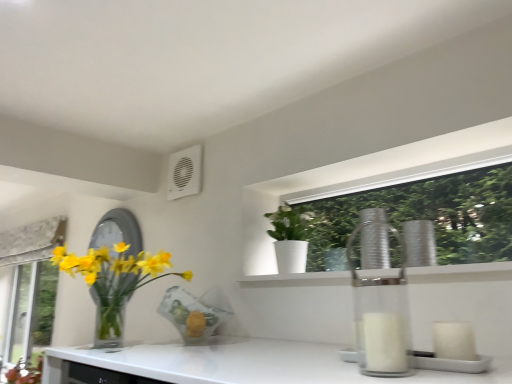
Question: Is translucent glass vase at left, the 1th houseplant positioned from the left, taller or shorter than white matte pot at upper center, which ranks as the 1th houseplant in right-to-left order?

Choices:
 (A) short
 (B) tall

Answer: (B)

Question: Is translucent glass vase at left, positioned as the 2th houseplant in right-to-left order, situated inside white matte pot at upper center, which ranks as the 1th houseplant in right-to-left order, or outside?

Choices:
 (A) inside
 (B) outside

Answer: (B)

Question: Estimate the real-world distances between objects in this image. Which object is closer to the silver metallic mirror at left?

Choices:
 (A) white matte pot at upper center, marked as the second houseplant in a left-to-right arrangement
 (B) translucent glass vase at left, the 1th houseplant positioned from the left
 (C) white plastic air conditioning unit at upper center

Answer: (B)

Question: Which of these objects is positioned closest to the translucent glass vase at left, positioned as the 2th houseplant in right-to-left order?

Choices:
 (A) white matte pot at upper center, which ranks as the 1th houseplant in right-to-left order
 (B) silver metallic mirror at left
 (C) white plastic air conditioning unit at upper center

Answer: (B)